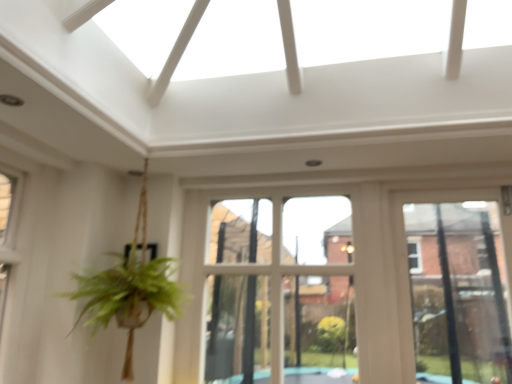
Question: Does white wood bay window at center have a lesser width compared to clear glass window at center?

Choices:
 (A) no
 (B) yes

Answer: (A)

Question: From a real-world perspective, is white wood bay window at center positioned over clear glass window at center based on gravity?

Choices:
 (A) no
 (B) yes

Answer: (B)

Question: Is white wood bay window at center surrounding clear glass window at center?

Choices:
 (A) yes
 (B) no

Answer: (B)

Question: From the image's perspective, is white wood bay window at center located above clear glass window at center?

Choices:
 (A) yes
 (B) no

Answer: (A)

Question: Does white wood bay window at center have a smaller size compared to clear glass window at center?

Choices:
 (A) no
 (B) yes

Answer: (A)

Question: From the image's perspective, is white wood bay window at center located beneath clear glass window at center?

Choices:
 (A) no
 (B) yes

Answer: (A)

Question: From the image's perspective, is clear glass window at center below white wood bay window at center?

Choices:
 (A) no
 (B) yes

Answer: (B)

Question: From the image's perspective, does clear glass window at center appear higher than white wood bay window at center?

Choices:
 (A) no
 (B) yes

Answer: (A)

Question: Is clear glass window at center wider than white wood bay window at center?

Choices:
 (A) yes
 (B) no

Answer: (B)

Question: Is there a large distance between clear glass window at center and white wood bay window at center?

Choices:
 (A) no
 (B) yes

Answer: (A)

Question: Can you see clear glass window at center touching white wood bay window at center?

Choices:
 (A) yes
 (B) no

Answer: (B)

Question: Can you confirm if clear glass window at center is taller than white wood bay window at center?

Choices:
 (A) yes
 (B) no

Answer: (B)

Question: In the image, is white wood bay window at center on the left side or the right side of clear glass window at center?

Choices:
 (A) right
 (B) left

Answer: (B)